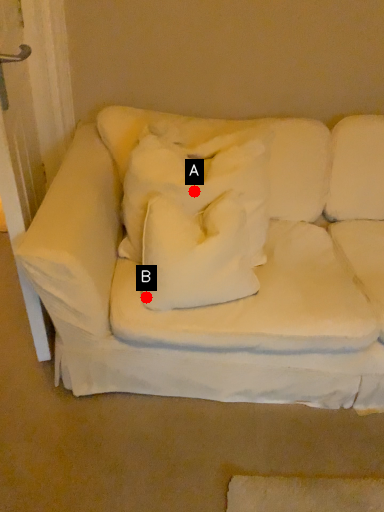
Question: Two points are circled on the image, labeled by A and B beside each circle. Which point appears closest to the camera in this image?

Choices:
 (A) A is closer
 (B) B is closer

Answer: (B)